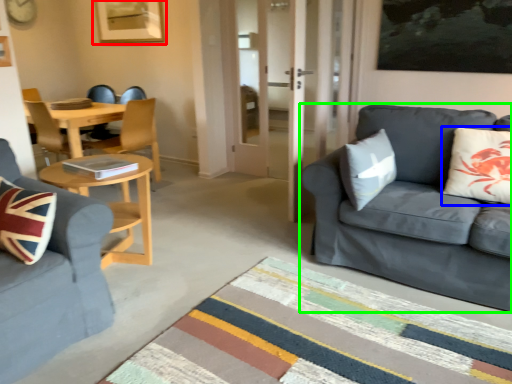
Question: Which object is the closest to the picture frame (highlighted by a red box)? Choose among these: pillow (highlighted by a blue box) or studio couch (highlighted by a green box).

Choices:
 (A) pillow
 (B) studio couch

Answer: (B)